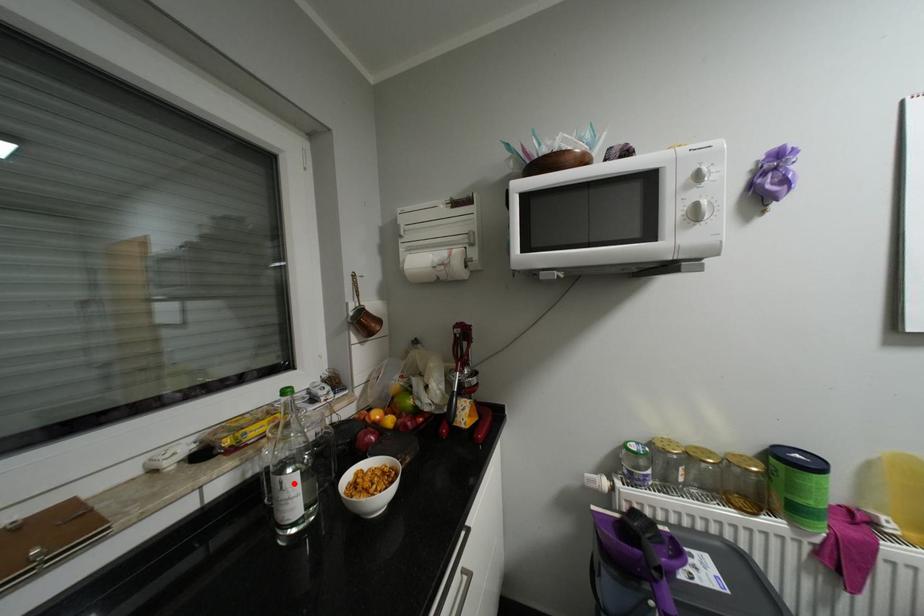
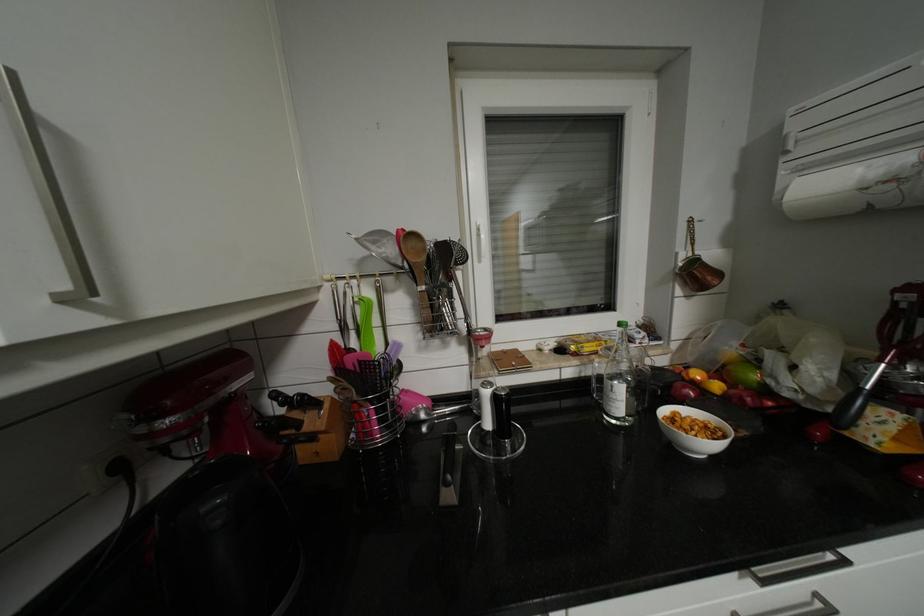
Where in the second image is the point corresponding to the highlighted location from the first image?

(623, 387)